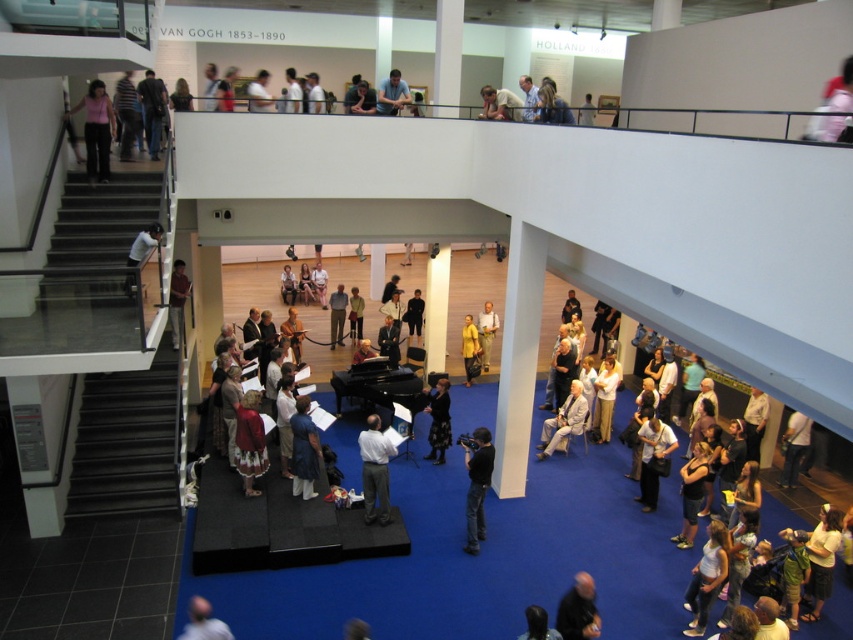
Question: Which object is closer to the camera taking this photo?

Choices:
 (A) white shirt at upper center
 (B) yellow matte shirt at center

Answer: (B)

Question: Considering the relative positions of dark blue jeans at center and matte black camera at upper center in the image provided, where is dark blue jeans at center located with respect to matte black camera at upper center?

Choices:
 (A) left
 (B) right

Answer: (B)

Question: Is matte pink blouse at upper left below black textured dress at center?

Choices:
 (A) yes
 (B) no

Answer: (B)

Question: Which object is the farthest from the light brown leather jacket at lower right?

Choices:
 (A) yellow matte shirt at center
 (B) matte black camera at upper center
 (C) red velvet dress at center

Answer: (B)

Question: Is light brown leather jacket at lower right behind yellow fabric bag at center?

Choices:
 (A) no
 (B) yes

Answer: (A)

Question: Which object appears closest to the camera in this image?

Choices:
 (A) dark brown hair at lower center
 (B) light blue shirt at lower left
 (C) light brown leather jacket at lower right
 (D) light blue shirt at upper center

Answer: (A)